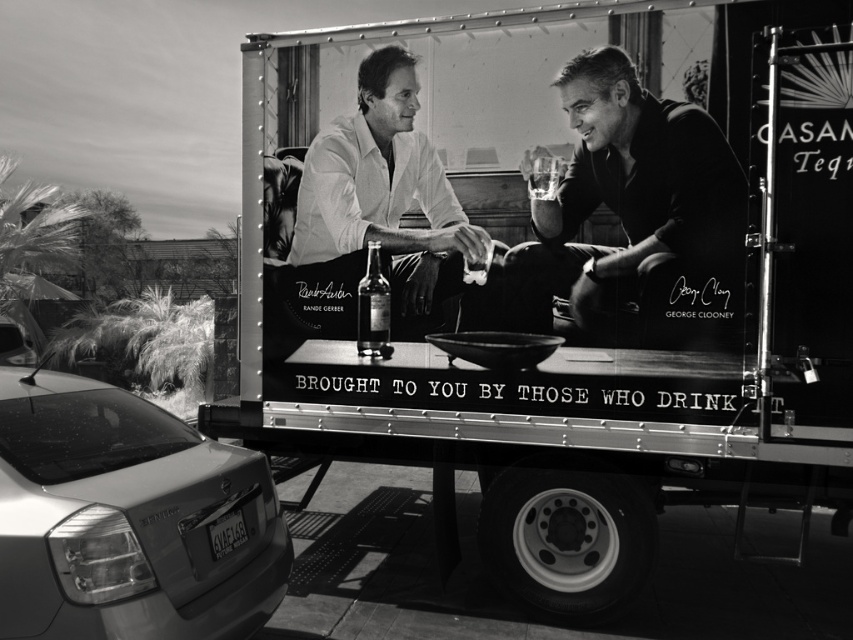
Question: Observing the image, what is the correct spatial positioning of satin silver sedan at lower left in reference to matte white shirt at center?

Choices:
 (A) above
 (B) below

Answer: (B)

Question: Which of these objects is positioned farthest from the black matte glass at upper right?

Choices:
 (A) matte white shirt at center
 (B) satin silver sedan at lower left
 (C) clear glass bottle at center
 (D) metallic trailer truck at center

Answer: (B)

Question: Does metallic trailer truck at center appear under satin silver sedan at lower left?

Choices:
 (A) yes
 (B) no

Answer: (B)

Question: Which of the following is the closest to the observer?

Choices:
 (A) satin silver sedan at lower left
 (B) black matte glass at upper right
 (C) matte white shirt at center

Answer: (A)

Question: Which object is positioned farthest from the translucent glass at center?

Choices:
 (A) black matte glass at upper right
 (B) matte white shirt at center
 (C) satin silver sedan at lower left
 (D) clear glass bottle at center

Answer: (C)

Question: Is metallic trailer truck at center to the left of translucent glass at center from the viewer's perspective?

Choices:
 (A) no
 (B) yes

Answer: (B)